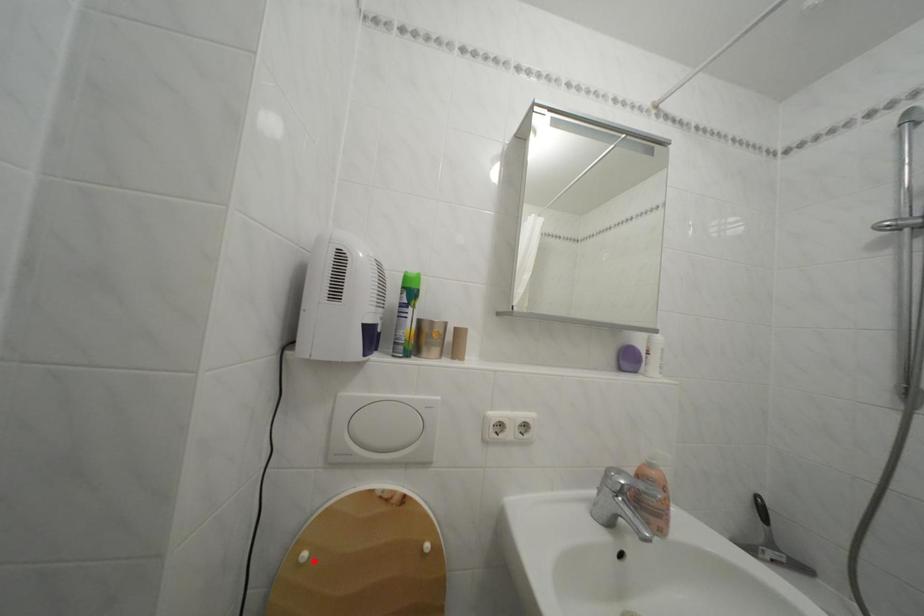
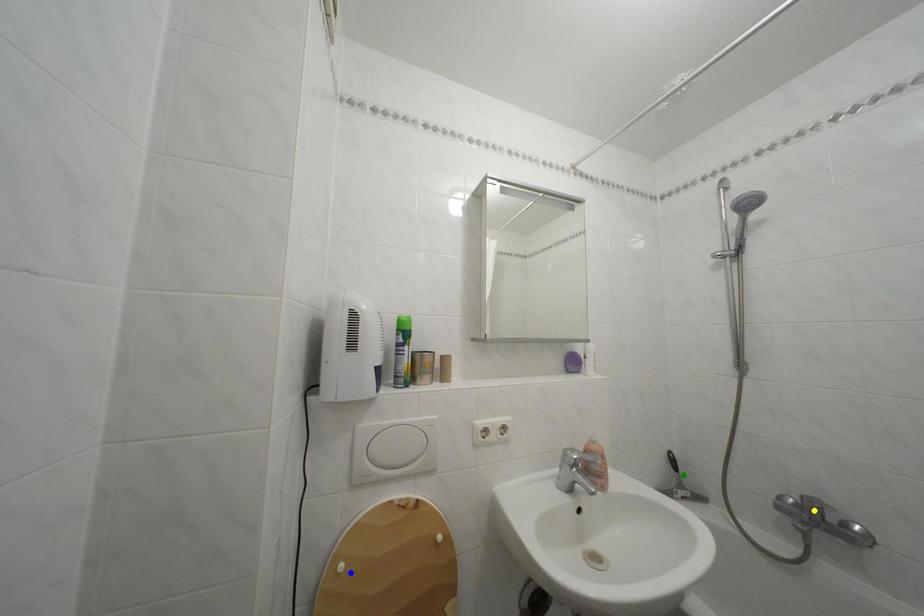
Question: I am providing you with two images of the same scene from different viewpoints. A red point is marked on the first image. You are given multiple points on the second image. Which point in image 2 represents the same 3d spot as the red point in image 1?

Choices:
 (A) blue point
 (B) yellow point
 (C) green point

Answer: (A)